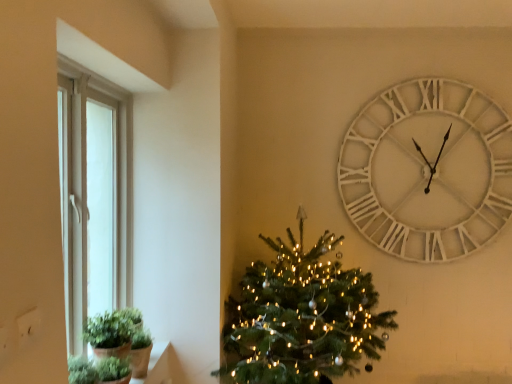
Question: In the image, is green matte plant at lower left positioned in front of or behind green matte christmas tree at center?

Choices:
 (A) front
 (B) behind

Answer: (A)

Question: In the image, is green matte plant at lower left on the left side or the right side of green matte christmas tree at center?

Choices:
 (A) left
 (B) right

Answer: (A)

Question: Which object is the closest to the green matte plant at lower left?

Choices:
 (A) green matte christmas tree at center
 (B) green matte plant at lower left
 (C) white wooden clock at upper right

Answer: (B)

Question: Based on their relative distances, which object is nearer to the white wooden clock at upper right?

Choices:
 (A) green matte plant at lower left
 (B) green matte christmas tree at center
 (C) green matte plant at lower left

Answer: (B)